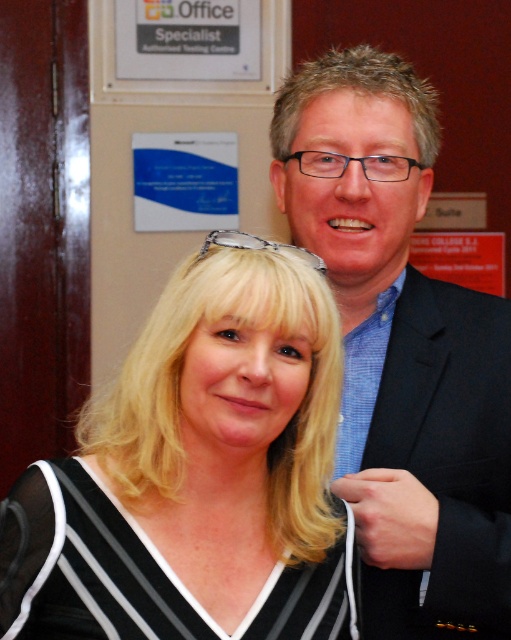
Question: Which object is the farthest from the black striped fabric dress at center?

Choices:
 (A) black textured suit at upper right
 (B) black striped blouse at center

Answer: (A)

Question: Among these objects, which one is farthest from the camera?

Choices:
 (A) black striped fabric dress at center
 (B) black striped blouse at center

Answer: (A)

Question: Does black striped blouse at center appear on the right side of black striped fabric dress at center?

Choices:
 (A) yes
 (B) no

Answer: (A)

Question: Does black striped blouse at center lie in front of black textured suit at upper right?

Choices:
 (A) no
 (B) yes

Answer: (B)

Question: Which of these objects is positioned farthest from the black striped fabric dress at center?

Choices:
 (A) black textured suit at upper right
 (B) black striped blouse at center

Answer: (A)

Question: Can you confirm if black striped blouse at center is bigger than black textured suit at upper right?

Choices:
 (A) yes
 (B) no

Answer: (B)